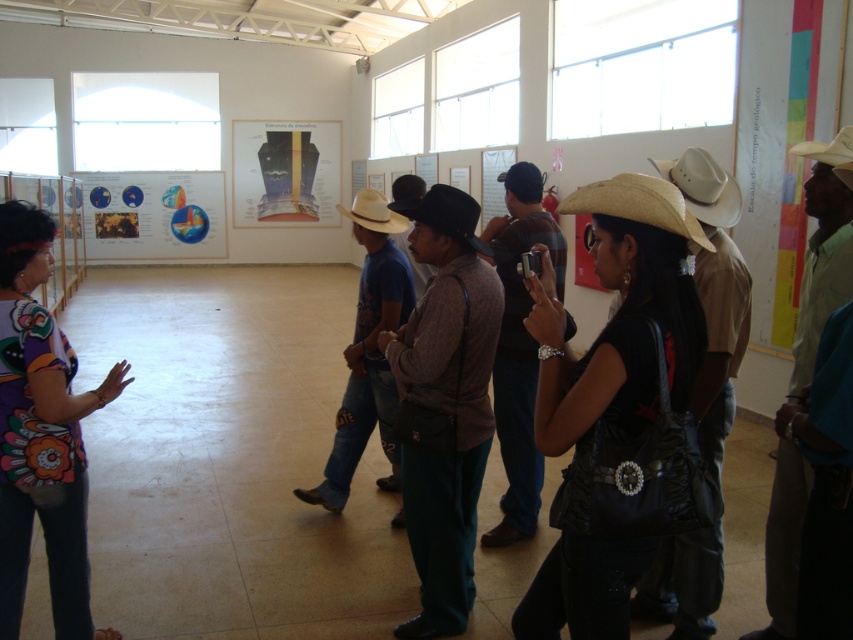
You are standing in the gallery and want to reach a specific point marked at coordinates point (15, 474). If you are currently 3 meters away from that point, how much closer do you need to get to touch it?

The distance of point (15, 474) from viewer is 2.65 meters. Therefore, you need to move 0.35 meters closer to reach it since 3 meters minus 2.65 meters equals 0.35 meters.

You are a fashion designer observing the indoor gallery scene. You notice the printed fabric blouse at left and the black felt cowboy hat at center. Which item would require more fabric to create a replica of the same size?

The printed fabric blouse at left requires more fabric to create a replica of the same size because it is larger in size than the black felt cowboy hat at center.